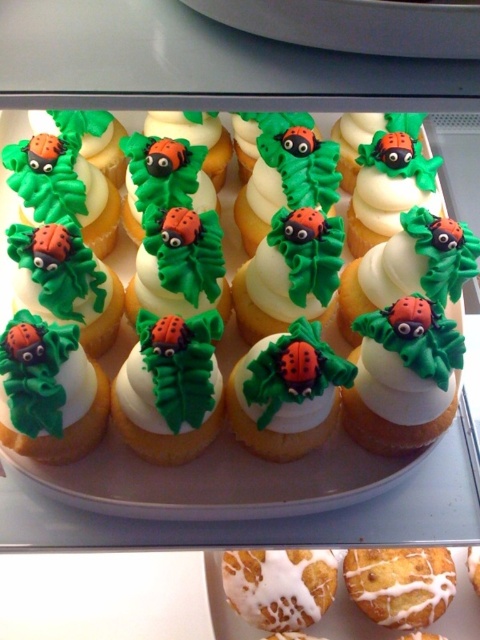
Does matte green leaf at center have a smaller size compared to matte orange ladybug at center?

Correct, matte green leaf at center occupies less space than matte orange ladybug at center.

Which is above, matte green leaf at center or matte orange ladybug at center?

matte orange ladybug at center is above.

Between point (216, 333) and point (312, 353), which one is positioned behind?

The point (216, 333) is behind.

In order to click on matte green leaf at center in this screenshot , I will do `click(169, 387)`.

Is white glazed donut at center wider than iced white bun at center?

Correct, the width of white glazed donut at center exceeds that of iced white bun at center.

Which is above, white glazed donut at center or iced white bun at center?

Positioned higher is white glazed donut at center.

The width and height of the screenshot is (480, 640). Find the location of `white glazed donut at center`. white glazed donut at center is located at coordinates (279, 586).

Does matte green leaf at center have a greater width compared to iced white bun at center?

Incorrect, matte green leaf at center's width does not surpass iced white bun at center's.

Does point (184, 420) come behind point (406, 611)?

No, it is not.

Identify the location of matte green leaf at center. This screenshot has height=640, width=480. (169, 387).